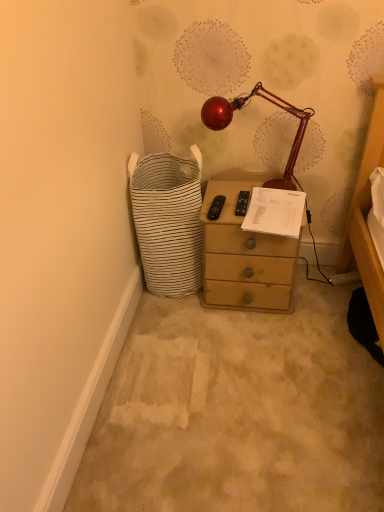
Question: Considering the relative sizes of glossy red lamp at upper center and white striped fabric basket at lower left in the image provided, is glossy red lamp at upper center bigger than white striped fabric basket at lower left?

Choices:
 (A) yes
 (B) no

Answer: (B)

Question: Can you confirm if glossy red lamp at upper center is smaller than white striped fabric basket at lower left?

Choices:
 (A) no
 (B) yes

Answer: (B)

Question: From a real-world perspective, is glossy red lamp at upper center under white striped fabric basket at lower left?

Choices:
 (A) no
 (B) yes

Answer: (A)

Question: Is glossy red lamp at upper center taller than white striped fabric basket at lower left?

Choices:
 (A) no
 (B) yes

Answer: (A)

Question: From the image's perspective, is glossy red lamp at upper center on white striped fabric basket at lower left?

Choices:
 (A) yes
 (B) no

Answer: (A)

Question: Does glossy red lamp at upper center have a lesser width compared to white striped fabric basket at lower left?

Choices:
 (A) no
 (B) yes

Answer: (B)

Question: Considering the relative sizes of matte brown chest of drawers at center and glossy red lamp at upper center in the image provided, is matte brown chest of drawers at center bigger than glossy red lamp at upper center?

Choices:
 (A) yes
 (B) no

Answer: (A)

Question: Is matte brown chest of drawers at center positioned with its back to glossy red lamp at upper center?

Choices:
 (A) yes
 (B) no

Answer: (B)

Question: Does matte brown chest of drawers at center touch glossy red lamp at upper center?

Choices:
 (A) no
 (B) yes

Answer: (A)

Question: Is matte brown chest of drawers at center behind glossy red lamp at upper center?

Choices:
 (A) no
 (B) yes

Answer: (B)

Question: Is matte brown chest of drawers at center not near glossy red lamp at upper center?

Choices:
 (A) yes
 (B) no

Answer: (B)

Question: From the image's perspective, is matte brown chest of drawers at center located above glossy red lamp at upper center?

Choices:
 (A) yes
 (B) no

Answer: (B)

Question: Is white striped fabric basket at lower left located outside matte brown chest of drawers at center?

Choices:
 (A) no
 (B) yes

Answer: (B)